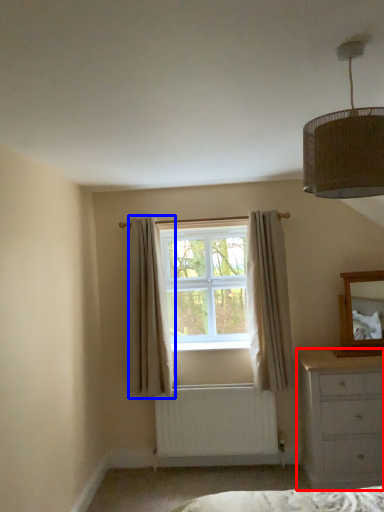
Question: Which object appears farthest to the camera in this image, chest of drawers (highlighted by a red box) or curtain (highlighted by a blue box)?

Choices:
 (A) chest of drawers
 (B) curtain

Answer: (B)